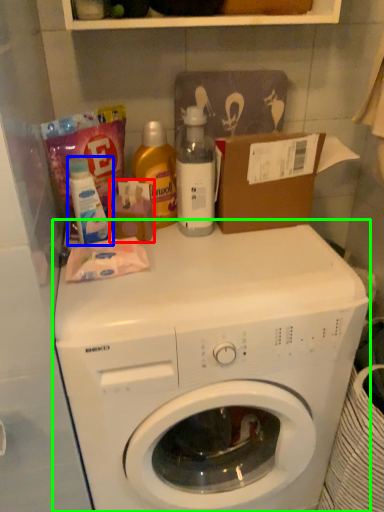
Question: Based on their relative distances, which object is farther from toiletry (highlighted by a red box)? Choose from cleaning product (highlighted by a blue box) and washing machine (highlighted by a green box).

Choices:
 (A) cleaning product
 (B) washing machine

Answer: (B)